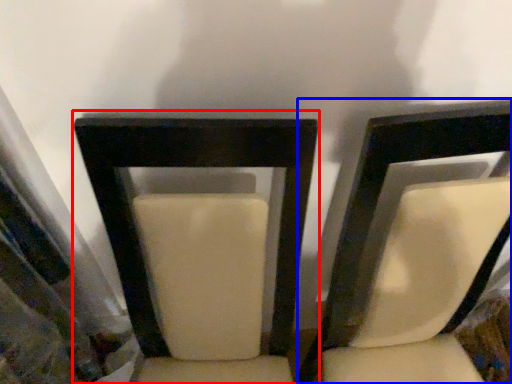
Question: Among these objects, which one is farthest to the camera, chair (highlighted by a red box) or chair (highlighted by a blue box)?

Choices:
 (A) chair
 (B) chair

Answer: (B)